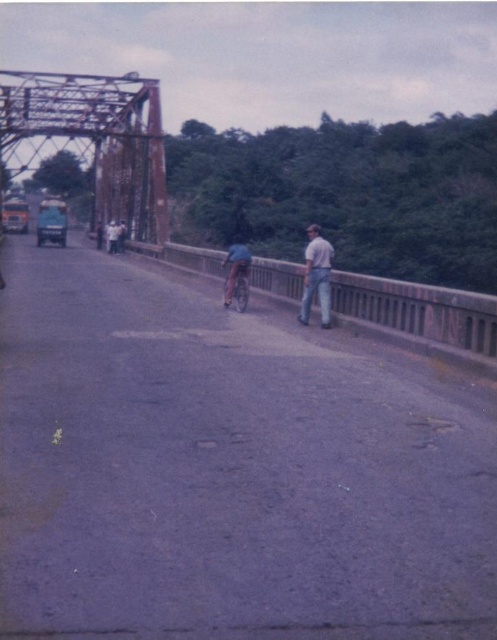
You are a cyclist approaching the bridge and see the matte asphalt bike path at center and the light brown shirt at center. Which object takes up more space in your view?

The matte asphalt bike path at center has a larger size compared to the light brown shirt at center, so it takes up more space in your view.

You are standing on the bridge and see the matte asphalt bike path at center and the light brown shirt at center. Which object is positioned to the left of the other?

The matte asphalt bike path at center is to the left of the light brown shirt at center.